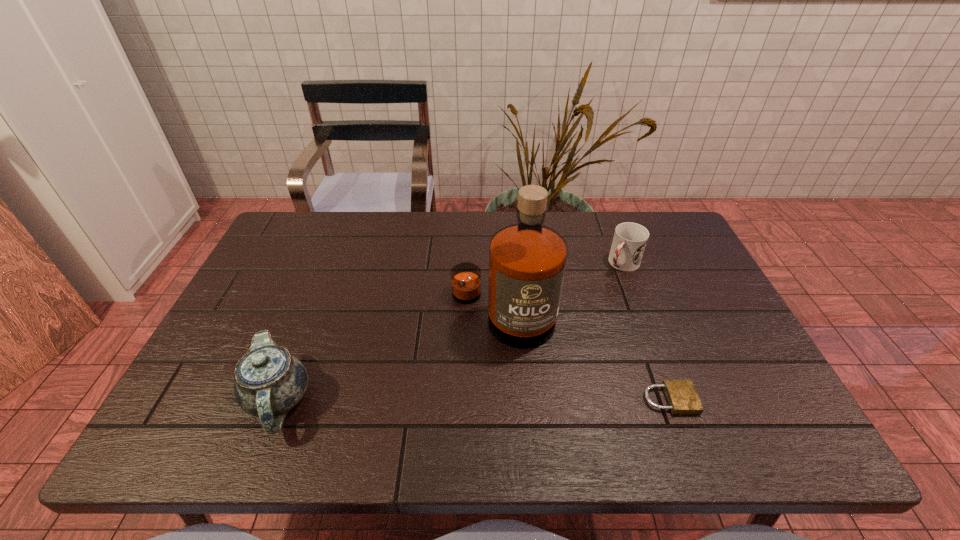
Where is `free point between the second shortest object and the padlock`? free point between the second shortest object and the padlock is located at coordinates (646, 332).

Find the location of a particular element. The width and height of the screenshot is (960, 540). vacant area that lies between the liquor and the leftmost object is located at coordinates (390, 357).

Where is `empty space between the shortest object and the cup`? The height and width of the screenshot is (540, 960). empty space between the shortest object and the cup is located at coordinates (646, 332).

This screenshot has width=960, height=540. Find the location of `free space between the liquor and the padlock`. free space between the liquor and the padlock is located at coordinates (586, 357).

The image size is (960, 540). Find the location of `empty space between the chinaware and the padlock`. empty space between the chinaware and the padlock is located at coordinates (473, 400).

This screenshot has width=960, height=540. I want to click on object that can be found as the third closest to the padlock, so click(269, 381).

Where is `object that can be found as the closest to the cup`? The height and width of the screenshot is (540, 960). object that can be found as the closest to the cup is located at coordinates pyautogui.click(x=527, y=260).

Image resolution: width=960 pixels, height=540 pixels. Identify the location of blank area in the image that satisfies the following two spatial constraints: 1. from the spout of the padlock; 2. on the keyhole side of the second tallest object. (278, 400).

Identify the location of free space that satisfies the following two spatial constraints: 1. from the spout of the padlock; 2. on the keyhole side of the leftmost object. The height and width of the screenshot is (540, 960). click(x=278, y=400).

The image size is (960, 540). Find the location of `vacant space that satisfies the following two spatial constraints: 1. on the back side of the cup; 2. on the right side of the tallest object`. vacant space that satisfies the following two spatial constraints: 1. on the back side of the cup; 2. on the right side of the tallest object is located at coordinates pyautogui.click(x=499, y=264).